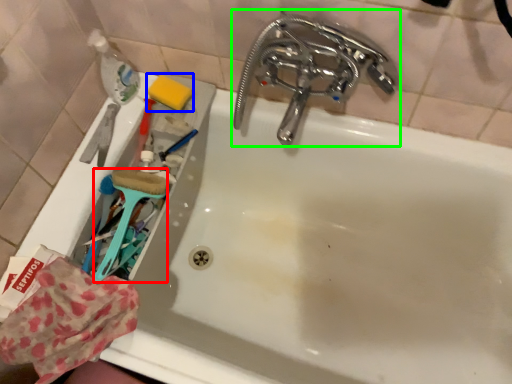
Question: Estimate the real-world distances between objects in this image. Which object is closer to brush (highlighted by a red box), soap (highlighted by a blue box) or tap (highlighted by a green box)?

Choices:
 (A) soap
 (B) tap

Answer: (A)